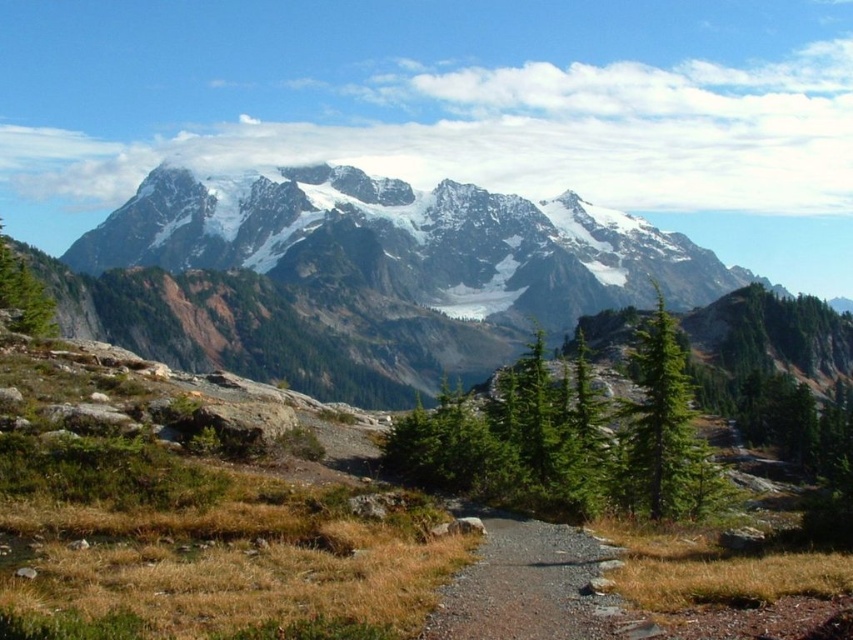
Between point (521, 518) and point (654, 284), which one is positioned in front?

Positioned in front is point (521, 518).

Who is shorter, gravel path at center or green textured tree at center-right?

gravel path at center is shorter.

The image size is (853, 640). I want to click on gravel path at center, so click(523, 584).

Where is `gravel path at center`? Image resolution: width=853 pixels, height=640 pixels. gravel path at center is located at coordinates (523, 584).

Who is more forward, (544, 216) or (479, 563)?

Point (479, 563)

Does snowy granite mountain range at center come in front of gravel path at center?

That is False.

Locate an element on the screen. snowy granite mountain range at center is located at coordinates (363, 276).

What are the coordinates of `snowy granite mountain range at center` in the screenshot? It's located at (363, 276).

Measure the distance between snowy granite mountain range at center and camera.

snowy granite mountain range at center and camera are 374.88 meters apart from each other.

Which is behind, point (397, 346) or point (648, 368)?

The point (397, 346) is behind.

Is point (282, 330) farther from camera compared to point (654, 337)?

Yes.

At what (x,y) coordinates should I click in order to perform the action: click on snowy granite mountain range at center. Please return your answer as a coordinate pair (x, y). Image resolution: width=853 pixels, height=640 pixels. Looking at the image, I should click on (363, 276).